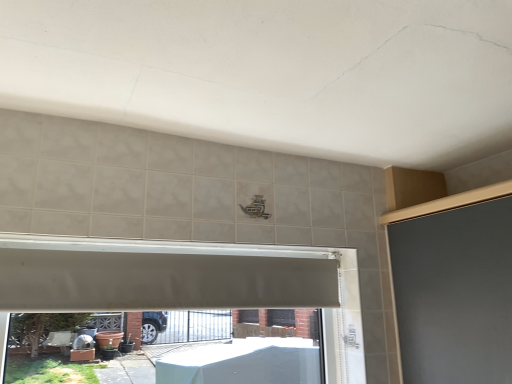
Question: Should I look upward or downward to see white matte exhaust hood at center?

Choices:
 (A) up
 (B) down

Answer: (B)

Question: Is white matte exhaust hood at center oriented towards white plastic window frame at center?

Choices:
 (A) yes
 (B) no

Answer: (B)

Question: Can you confirm if white matte exhaust hood at center is thinner than white plastic window frame at center?

Choices:
 (A) no
 (B) yes

Answer: (B)

Question: Would you consider white matte exhaust hood at center to be distant from white plastic window frame at center?

Choices:
 (A) yes
 (B) no

Answer: (B)

Question: From a real-world perspective, is white matte exhaust hood at center positioned under white plastic window frame at center based on gravity?

Choices:
 (A) no
 (B) yes

Answer: (A)

Question: Does white matte exhaust hood at center have a greater height compared to white plastic window frame at center?

Choices:
 (A) no
 (B) yes

Answer: (A)

Question: Considering the relative sizes of white matte exhaust hood at center and white plastic window frame at center in the image provided, is white matte exhaust hood at center bigger than white plastic window frame at center?

Choices:
 (A) no
 (B) yes

Answer: (A)

Question: Can you see white plastic window frame at center touching white matte exhaust hood at center?

Choices:
 (A) no
 (B) yes

Answer: (B)

Question: Is white matte exhaust hood at center at the back of white plastic window frame at center?

Choices:
 (A) yes
 (B) no

Answer: (A)

Question: Is white plastic window frame at center to the left of white matte exhaust hood at center from the viewer's perspective?

Choices:
 (A) no
 (B) yes

Answer: (B)

Question: Does white plastic window frame at center come behind white matte exhaust hood at center?

Choices:
 (A) yes
 (B) no

Answer: (B)

Question: Can you confirm if white plastic window frame at center is smaller than white matte exhaust hood at center?

Choices:
 (A) yes
 (B) no

Answer: (B)

Question: Is white plastic window frame at center bigger than white matte exhaust hood at center?

Choices:
 (A) yes
 (B) no

Answer: (A)

Question: In the image, is white plastic window frame at center positioned in front of or behind white matte exhaust hood at center?

Choices:
 (A) behind
 (B) front

Answer: (B)